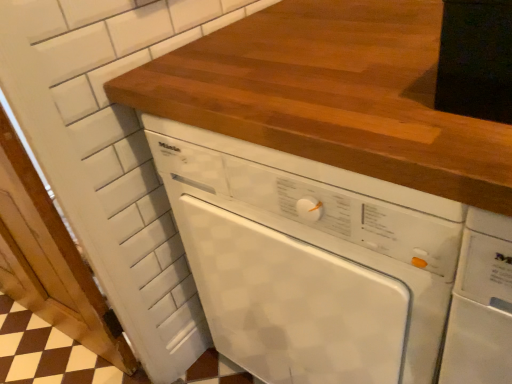
Question: From the image's perspective, is white glossy dishwasher at center above or below white painted wood door at left?

Choices:
 (A) above
 (B) below

Answer: (A)

Question: In the image, is white glossy dishwasher at center positioned in front of or behind white painted wood door at left?

Choices:
 (A) behind
 (B) front

Answer: (B)

Question: Which object is positioned closest to the white painted wood door at left?

Choices:
 (A) wooden countertop at center
 (B) white glossy dishwasher at center

Answer: (B)

Question: Which object is positioned closest to the white glossy dishwasher at center?

Choices:
 (A) wooden countertop at center
 (B) white painted wood door at left

Answer: (A)